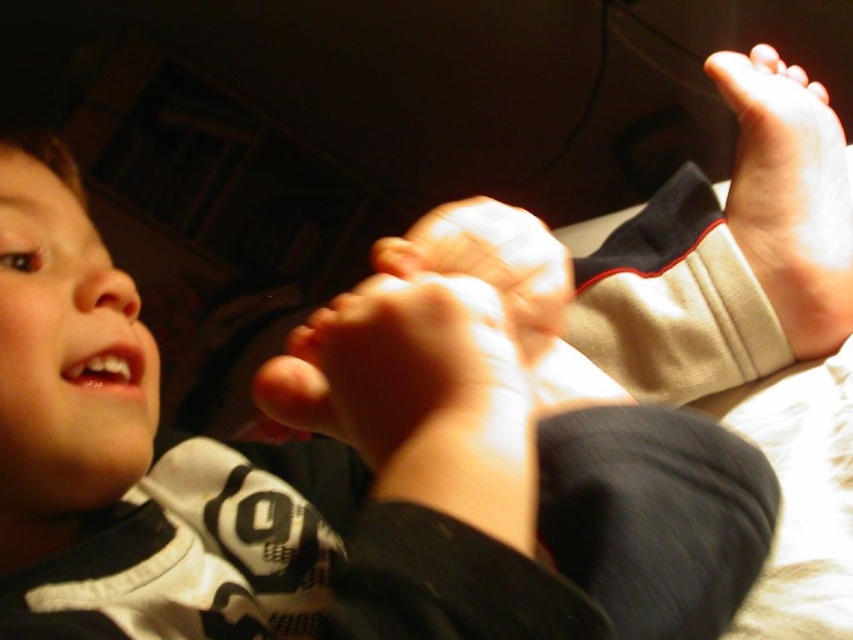
You are holding a small toy that is 3 inches wide. You want to place it exactly at the point marked as point (366,371) in the image. Can you fit the toy there without it overlapping with any other objects?

The point (366,371) is 12.05 inches away from the viewer. Since the toy is only 3 inches wide, there is enough space to place it there without overlapping with other objects.